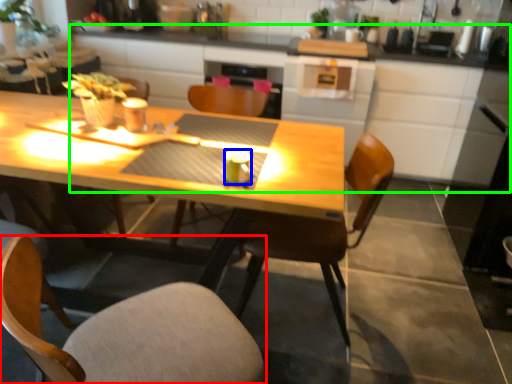
Question: Which object is the farthest from chair (highlighted by a red box)? Choose among these: coffee cup (highlighted by a blue box) or counter (highlighted by a green box).

Choices:
 (A) coffee cup
 (B) counter

Answer: (B)